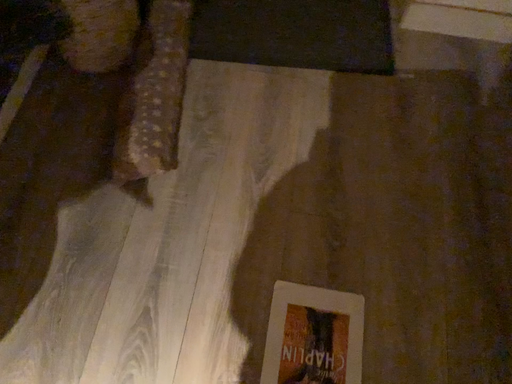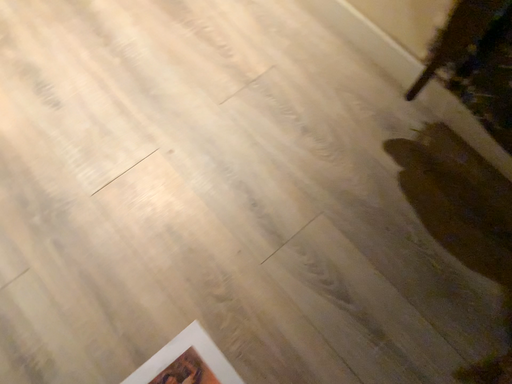
Question: How did the camera likely rotate when shooting the video?

Choices:
 (A) rotated right
 (B) rotated left

Answer: (B)